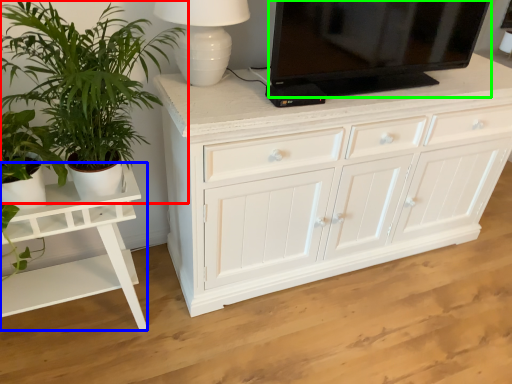
Question: Which object is positioned farthest from houseplant (highlighted by a red box)? Select from table (highlighted by a blue box) and television (highlighted by a green box).

Choices:
 (A) table
 (B) television

Answer: (B)